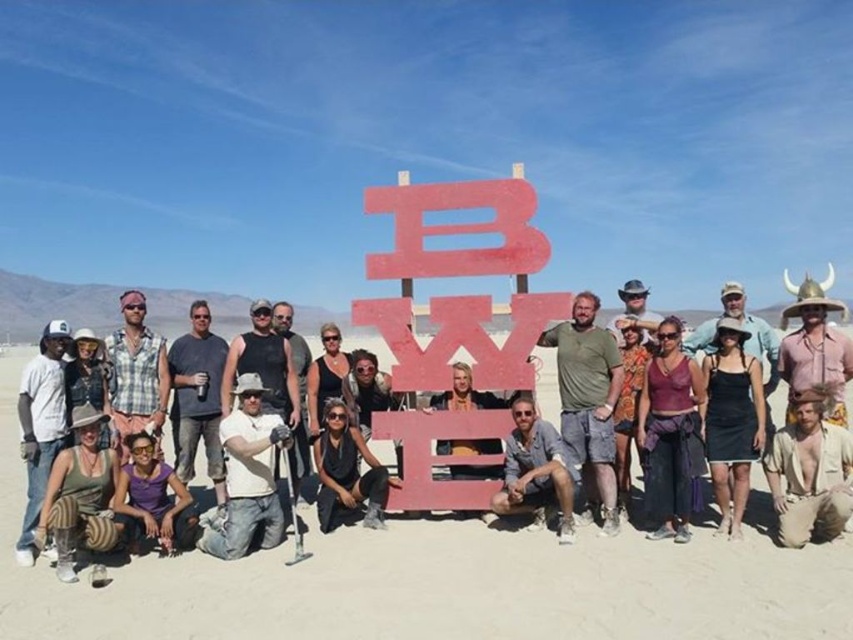
You are a photographer standing at the center of the scene, aiming to capture a group photo of the brown cotton shirt at lower right and the black matte dress at center. Given that your camera has a maximum focus range of 5 meters, will you be able to capture both subjects clearly in the same frame?

The distance between the brown cotton shirt at lower right and the black matte dress at center is 5.07 meters. Since the camera can only focus up to 5 meters, the subjects are slightly out of range, so you might need to adjust your position or use a different camera setting to ensure both are in focus.

You are a photographer taking a group photo. You need to ensure that the brown cotton shirt at lower right and the black matte dress at center are both visible in the frame. Which clothing item should you focus on first to ensure it fits within the camera frame?

The brown cotton shirt at lower right is smaller than the black matte dress at center, so you should focus on ensuring the black matte dress at center fits first since it is larger and might require more space in the frame.

You are a photographer standing at the camera position. You want to adjust the focus to capture the purple fabric skirt at lower center clearly. What is the required focus distance in meters?

The required focus distance is 9.27 meters to capture the purple fabric skirt at lower center clearly.